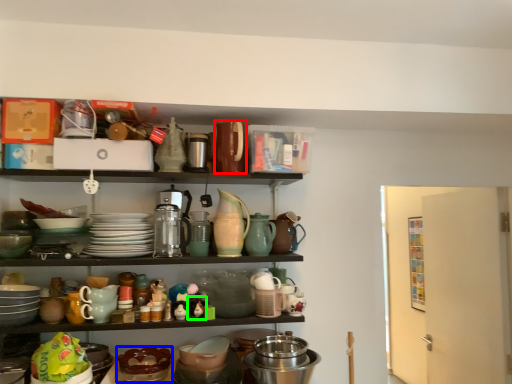
Question: Which object is the farthest from appliance (highlighted by a red box)? Choose among these: tableware (highlighted by a blue box) or toy (highlighted by a green box).

Choices:
 (A) tableware
 (B) toy

Answer: (A)